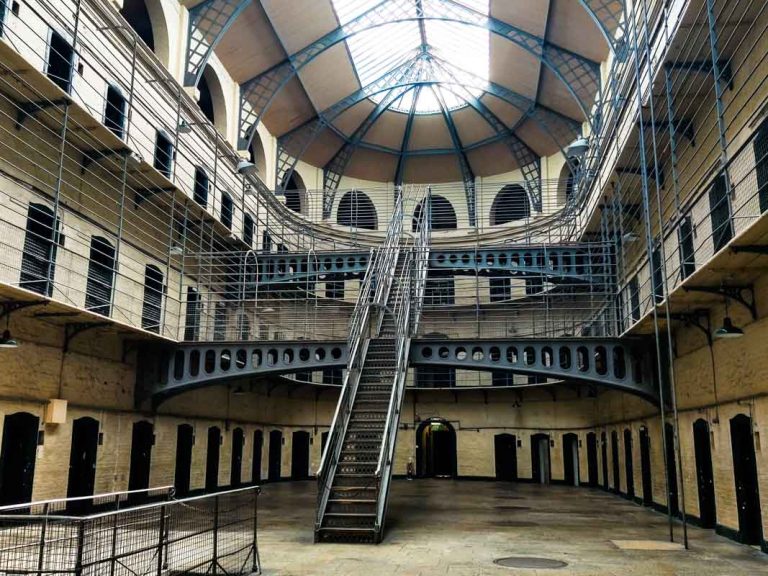
I want to click on black doors, so click(x=12, y=469), click(x=78, y=444), click(x=147, y=463), click(x=189, y=454), click(x=212, y=452), click(x=237, y=464), click(x=504, y=461), click(x=545, y=464), click(x=746, y=488), click(x=699, y=485).